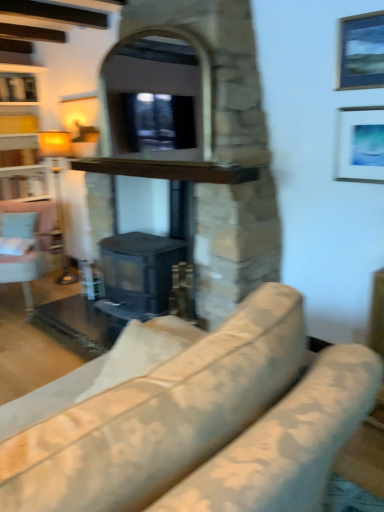
Question: From the image's perspective, is brown wooden shelf at center below matte yellow lampshade at left?

Choices:
 (A) yes
 (B) no

Answer: (B)

Question: Does brown wooden shelf at center have a larger size compared to matte yellow lampshade at left?

Choices:
 (A) yes
 (B) no

Answer: (B)

Question: From a real-world perspective, does brown wooden shelf at center sit lower than matte yellow lampshade at left?

Choices:
 (A) no
 (B) yes

Answer: (A)

Question: Is brown wooden shelf at center outside matte yellow lampshade at left?

Choices:
 (A) no
 (B) yes

Answer: (B)

Question: Considering the relative sizes of brown wooden shelf at center and matte yellow lampshade at left in the image provided, is brown wooden shelf at center wider than matte yellow lampshade at left?

Choices:
 (A) yes
 (B) no

Answer: (A)

Question: Is matte black fireplace at center, which is counted as the second fireplace, starting from the bottom, to the left or to the right of brown wooden shelf at center in the image?

Choices:
 (A) left
 (B) right

Answer: (A)

Question: Is matte black fireplace at center, the first fireplace in the top-to-bottom sequence, in front of or behind brown wooden shelf at center in the image?

Choices:
 (A) front
 (B) behind

Answer: (A)

Question: Looking at the image, does matte black fireplace at center, which is counted as the second fireplace, starting from the bottom, seem bigger or smaller compared to brown wooden shelf at center?

Choices:
 (A) small
 (B) big

Answer: (B)

Question: Considering the positions of point (263, 138) and point (144, 170), is point (263, 138) closer or farther from the camera than point (144, 170)?

Choices:
 (A) farther
 (B) closer

Answer: (B)

Question: Is point (0, 270) positioned closer to the camera than point (375, 38)?

Choices:
 (A) farther
 (B) closer

Answer: (A)

Question: From a real-world perspective, is light blue fabric swivel chair at left positioned above or below metallic silver picture frame at upper right, the first picture frame viewed from the top?

Choices:
 (A) below
 (B) above

Answer: (A)

Question: Looking at their shapes, would you say light blue fabric swivel chair at left is wider or thinner than metallic silver picture frame at upper right, the 2th picture frame positioned from the bottom?

Choices:
 (A) wide
 (B) thin

Answer: (A)

Question: From their relative heights in the image, would you say light blue fabric swivel chair at left is taller or shorter than metallic silver picture frame at upper right, the first picture frame viewed from the top?

Choices:
 (A) tall
 (B) short

Answer: (A)

Question: From the image's perspective, is black matte fireplace at center, the 1th fireplace positioned from the bottom, above or below matte white picture frame at upper right, arranged as the first picture frame when ordered from the bottom?

Choices:
 (A) above
 (B) below

Answer: (B)

Question: In the image, is black matte fireplace at center, which is the second fireplace from top to bottom, positioned in front of or behind matte white picture frame at upper right, acting as the second picture frame starting from the top?

Choices:
 (A) behind
 (B) front

Answer: (A)